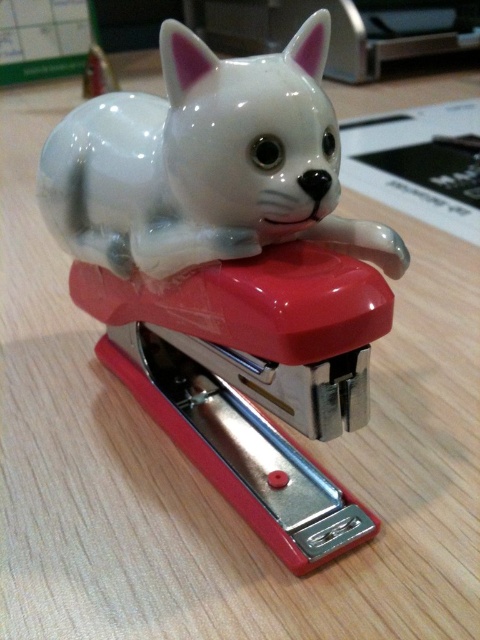
You are organizing your desk and need to place a new item between the red glossy stapler at center and the white glossy cat at center. Which object should you move to make space, considering their sizes?

The red glossy stapler at center is bigger than the white glossy cat at center. To make space, you should move the red glossy stapler at center since it is larger and might require more room to accommodate the new item.

You are a delivery robot that needs to place a package on the desk. The package is 36 inches long. Can you place the package on the desk without it overlapping the red glossy stapler at center?

The distance between the red glossy stapler at center and the viewer is 34.19 inches. Since the package is 36 inches long, it might overlap the stapler if placed directly in front of it. However, the exact placement depends on the desk size and the robot positioning. The given information only specifies the distance from the viewer to the stapler, not the desk dimensions or the package placement direction. Without additional details, it is uncertain if the package will overlap the red glossy stapler at the

You are organizing your desk and want to place a new pen holder between the red glossy stapler at center and the white glossy cat at center. Based on their positions, where should the pen holder be placed to ensure it sits above both objects?

The pen holder should be placed above the white glossy cat at center since the red glossy stapler at center is positioned under it, meaning the cat is above the stapler.